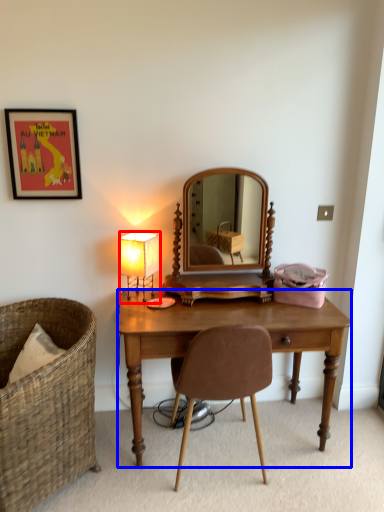
Question: Which of the following is the closest to the observer, lamp (highlighted by a red box) or desk (highlighted by a blue box)?

Choices:
 (A) lamp
 (B) desk

Answer: (B)